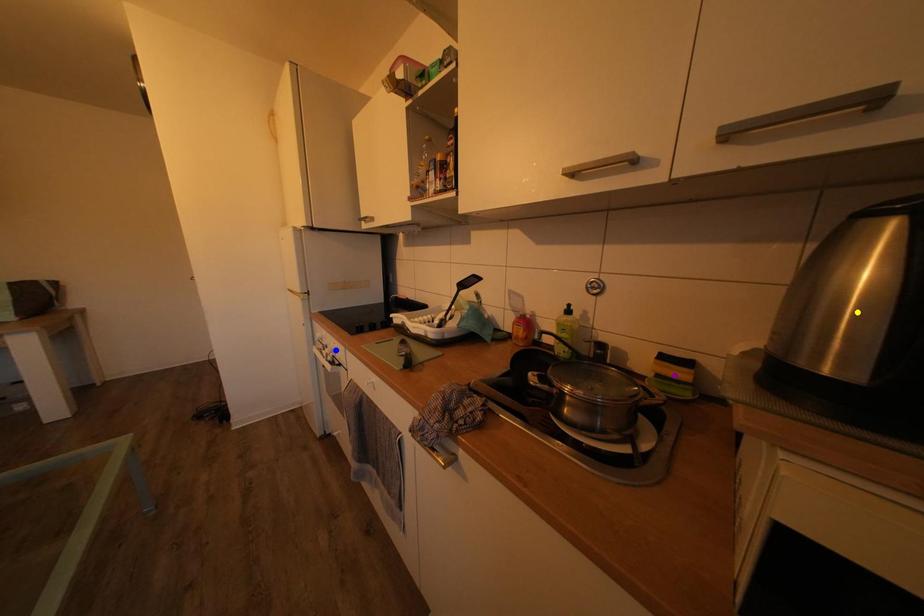
Order these from nearest to farthest:
1. yellow point
2. blue point
3. purple point

blue point
purple point
yellow point